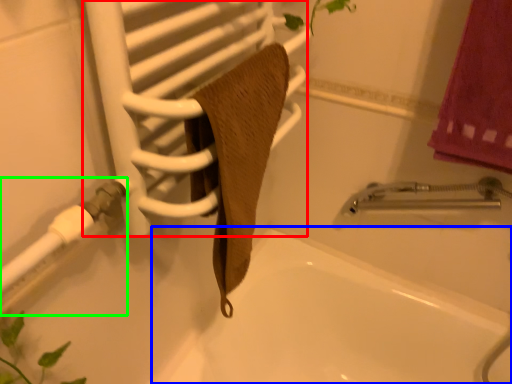
Question: Which is farther away from screen door (highlighted by a red box)? bath (highlighted by a blue box) or shower (highlighted by a green box)?

Choices:
 (A) bath
 (B) shower

Answer: (A)